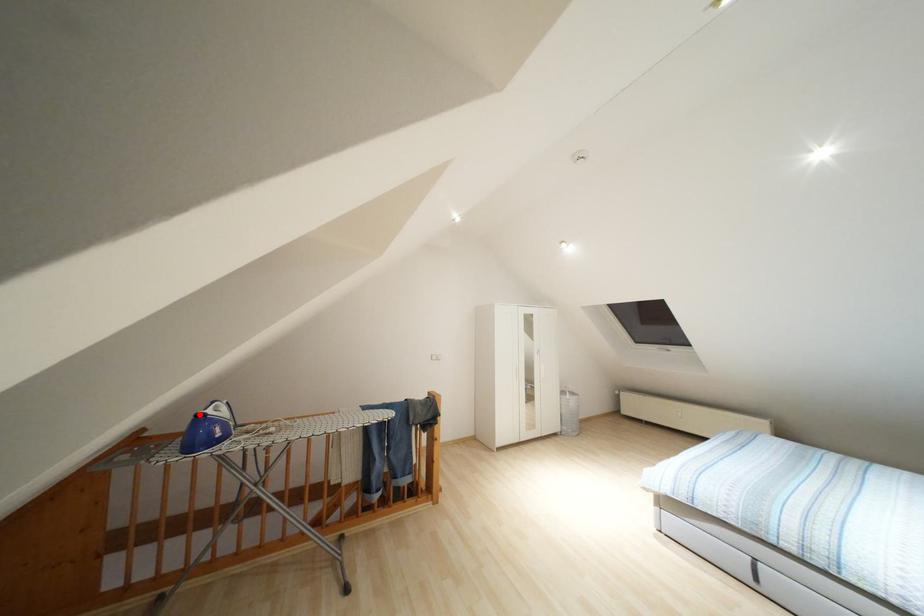
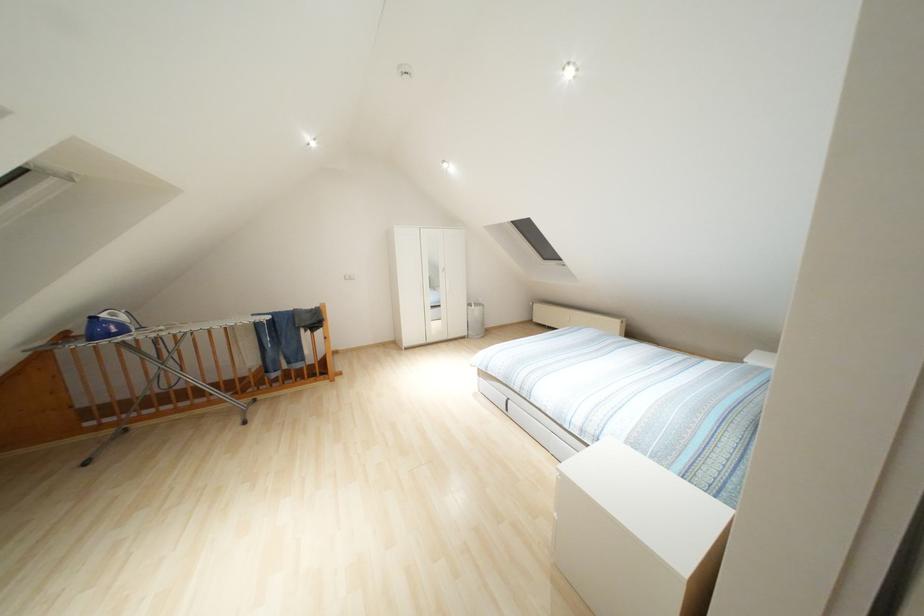
In the second image, find the point that corresponds to the highlighted location in the first image.

(92, 318)